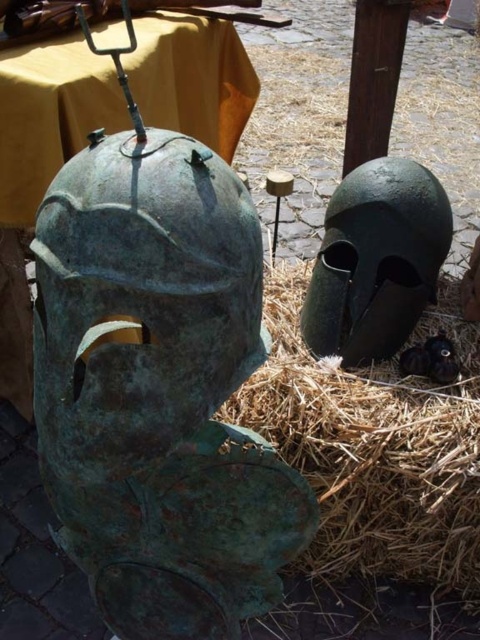
Question: Which object appears farthest from the camera in this image?

Choices:
 (A) green patinated metal helmet at upper right
 (B) green patinated bronze helmet at left

Answer: (A)

Question: Is green patinated bronze helmet at left behind brown straw at center?

Choices:
 (A) yes
 (B) no

Answer: (B)

Question: Is green patinated bronze helmet at left above green patinated metal helmet at upper right?

Choices:
 (A) yes
 (B) no

Answer: (B)

Question: Which is nearer to the green patinated metal helmet at upper right?

Choices:
 (A) brown straw at center
 (B) green patinated bronze helmet at left

Answer: (A)

Question: Estimate the real-world distances between objects in this image. Which object is closer to the green patinated bronze helmet at left?

Choices:
 (A) brown straw at center
 (B) green patinated metal helmet at upper right

Answer: (A)

Question: Can you confirm if green patinated bronze helmet at left is positioned below green patinated metal helmet at upper right?

Choices:
 (A) yes
 (B) no

Answer: (A)